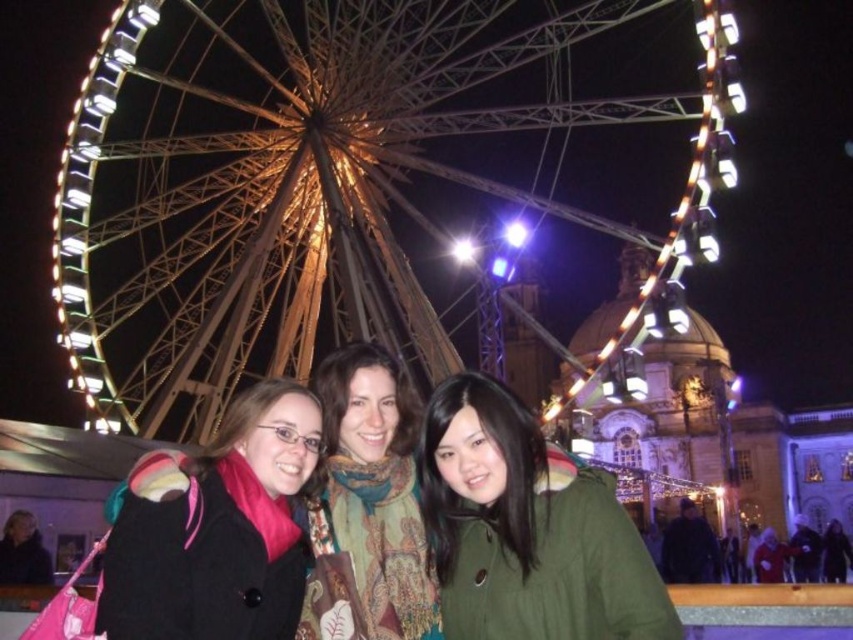
Question: Which is nearer to the metallic ferris wheel at upper center?

Choices:
 (A) matte black coat at center
 (B) green textured scarf at center
 (C) green matte jacket at lower center

Answer: (B)

Question: Among these objects, which one is nearest to the camera?

Choices:
 (A) green matte jacket at lower center
 (B) metallic ferris wheel at upper center
 (C) green textured scarf at center
 (D) matte black coat at center

Answer: (D)

Question: Does matte black coat at center have a greater width compared to green textured scarf at center?

Choices:
 (A) no
 (B) yes

Answer: (B)

Question: Which object is closer to the camera taking this photo?

Choices:
 (A) matte black coat at center
 (B) green textured scarf at center
 (C) metallic ferris wheel at upper center
 (D) green matte jacket at lower center

Answer: (A)

Question: From the image, what is the correct spatial relationship of green matte jacket at lower center in relation to green textured scarf at center?

Choices:
 (A) below
 (B) above

Answer: (A)

Question: Does green matte jacket at lower center appear on the right side of green textured scarf at center?

Choices:
 (A) yes
 (B) no

Answer: (A)